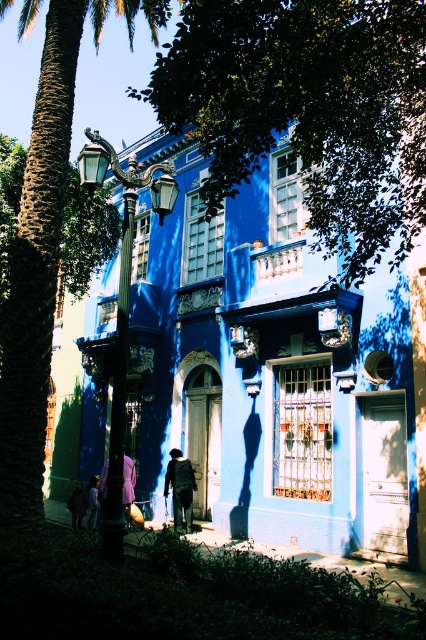
Does green leafy tree at upper center come in front of light brown fabric pants at lower left?

That is True.

Measure the distance between green leafy tree at upper center and light brown fabric pants at lower left.

40.53 feet

Identify the location of green leafy tree at upper center. The image size is (426, 640). (307, 109).

From the picture: How much distance is there between dark blue fabric jacket at center and light brown fabric pants at lower left?

They are 9.24 feet apart.

What do you see at coordinates (180, 486) in the screenshot?
I see `dark blue fabric jacket at center` at bounding box center [180, 486].

The height and width of the screenshot is (640, 426). In order to click on dark blue fabric jacket at center in this screenshot , I will do `click(180, 486)`.

Does green leafy tree at upper center have a lesser height compared to dark blue fabric jacket at center?

No, green leafy tree at upper center is not shorter than dark blue fabric jacket at center.

Based on the photo, who is more forward, [377,29] or [186,502]?

Point [377,29]

Who is more distant from viewer, (x=270, y=109) or (x=176, y=490)?

The point (x=176, y=490) is more distant.

Image resolution: width=426 pixels, height=640 pixels. Identify the location of green leafy tree at upper center. (307, 109).